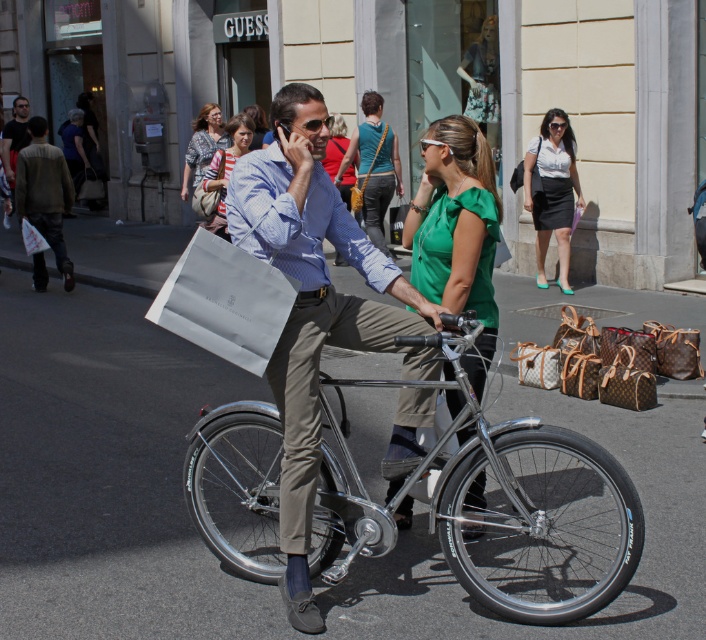
You are a store employee who needs to place the matte white blouse at upper center and the patterned fabric handbag at upper left on a display shelf. Which item should you place first if you want to ensure both items are visible without one blocking the other?

The matte white blouse at upper center is smaller in size compared to the patterned fabric handbag at upper left. Therefore, you should place the patterned fabric handbag at upper left first, then the matte white blouse at upper center on top of it to ensure both are visible.

From the picture: You are a delivery person who needs to place a matte white blouse at upper center and a patterned fabric handbag at upper left into a delivery box. The box can only hold items within 15 feet of each other. Can you fit both items into the box?

The distance between the matte white blouse at upper center and the patterned fabric handbag at upper left is 14.49 feet, which is within the 15 feet limit. Therefore, both items can be placed in the same delivery box.